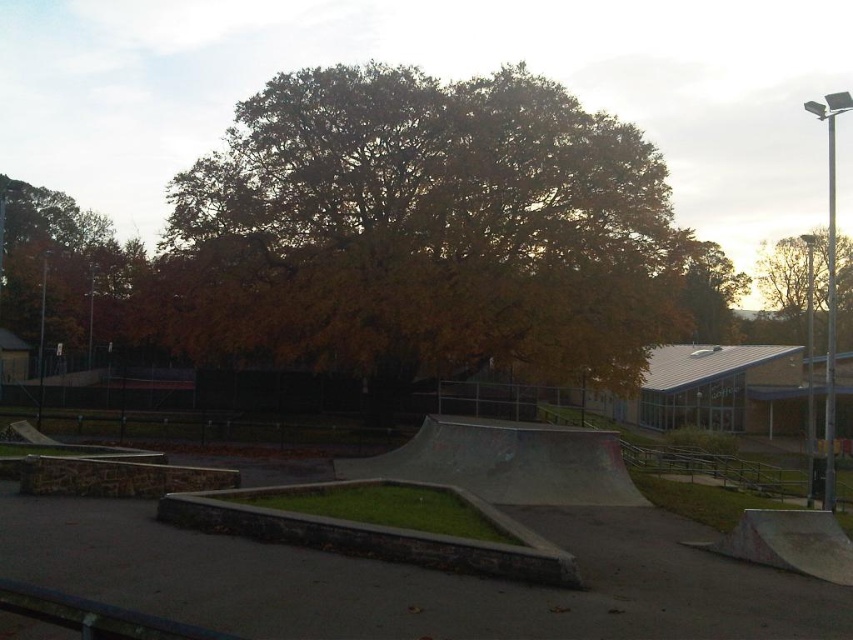
Question: Which point is closer to the camera taking this photo?

Choices:
 (A) (386, 177)
 (B) (766, 323)

Answer: (A)

Question: Can you confirm if yellow-green leaves at center is thinner than yellow leafy tree at upper center?

Choices:
 (A) yes
 (B) no

Answer: (A)

Question: Is autumn leaves at left positioned at the back of brown leafy tree at upper right?

Choices:
 (A) no
 (B) yes

Answer: (A)

Question: Which of the following is the closest to the observer?

Choices:
 (A) autumn leaves at left
 (B) yellow leafy tree at upper center

Answer: (B)

Question: Does yellow-green leaves at center have a lesser width compared to yellow leafy tree at upper center?

Choices:
 (A) no
 (B) yes

Answer: (B)

Question: Which point is farther to the camera?

Choices:
 (A) (727, 294)
 (B) (769, 282)
 (C) (109, 262)
 (D) (189, 307)

Answer: (B)